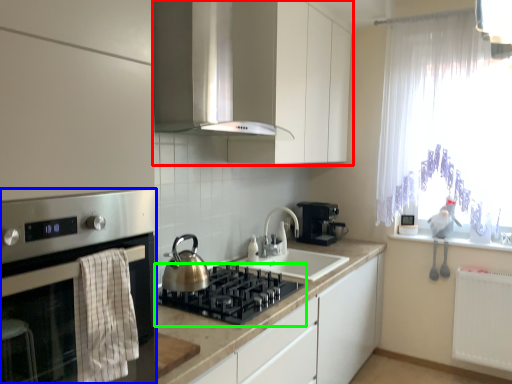
Question: Which object is the closest to the cabinetry (highlighted by a red box)? Choose among these: home appliance (highlighted by a blue box) or gas stove (highlighted by a green box).

Choices:
 (A) home appliance
 (B) gas stove

Answer: (B)